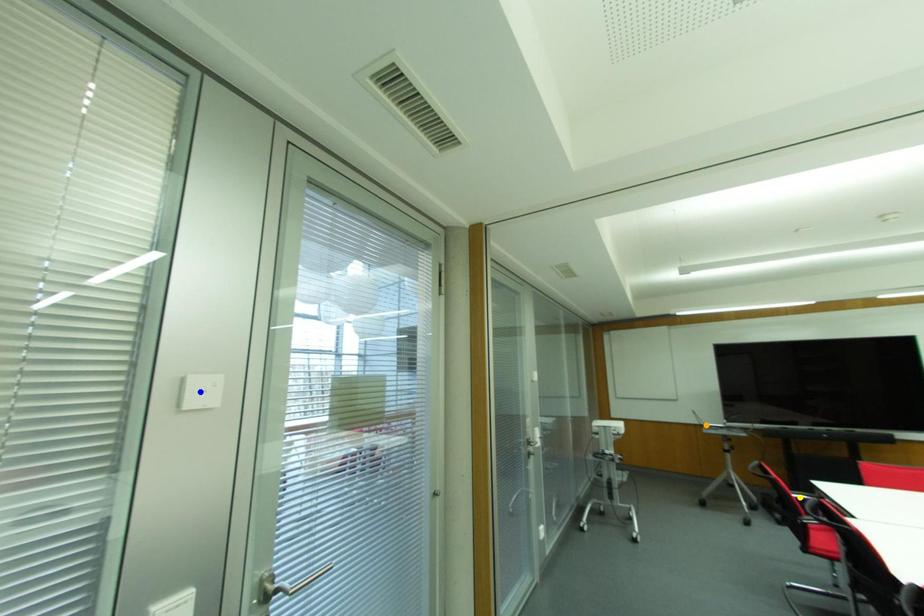
Order these from nearest to farthest:
1. blue point
2. orange point
3. yellow point

orange point
yellow point
blue point